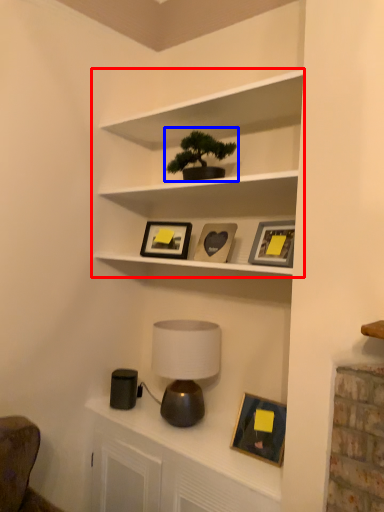
Question: Among these objects, which one is farthest to the camera, shelf (highlighted by a red box) or houseplant (highlighted by a blue box)?

Choices:
 (A) shelf
 (B) houseplant

Answer: (B)